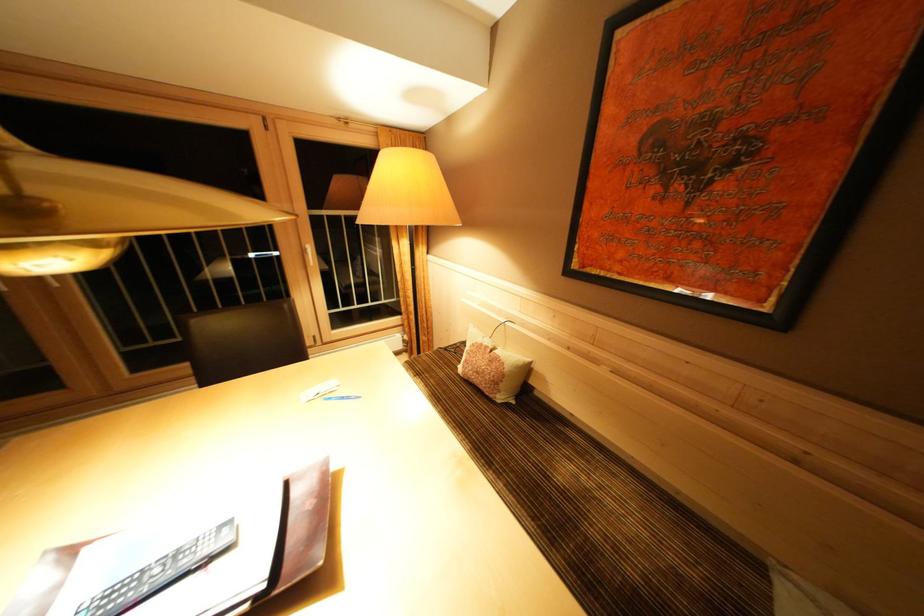
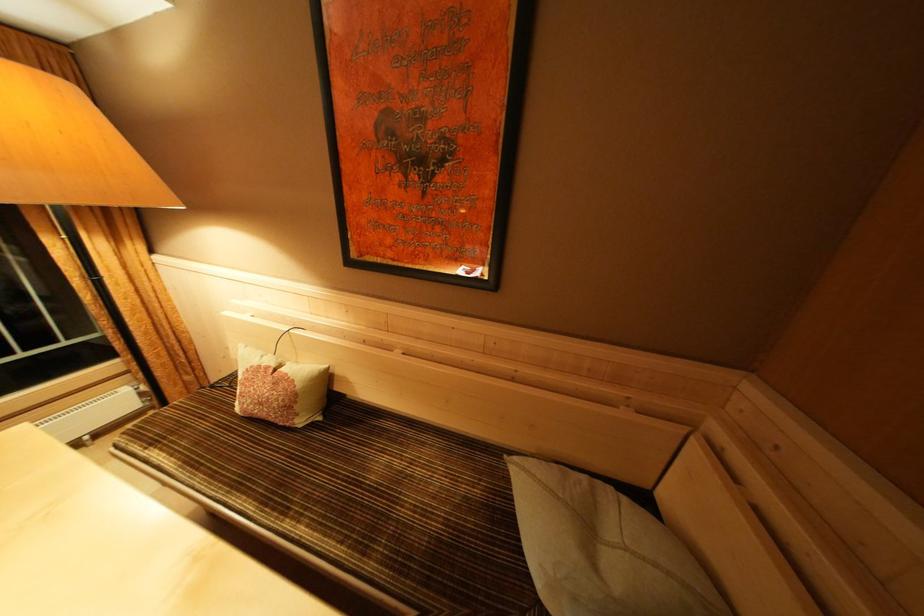
Question: Based on the continuous images, in which direction is the camera rotating? Reply with the corresponding letter.

Choices:
 (A) Left
 (B) Right
 (C) Up
 (D) Down

Answer: (B)